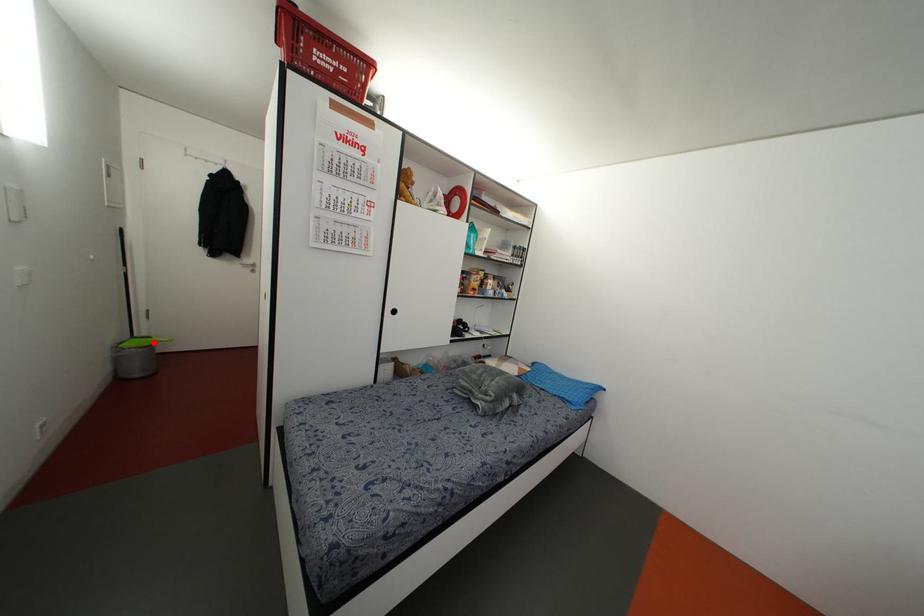
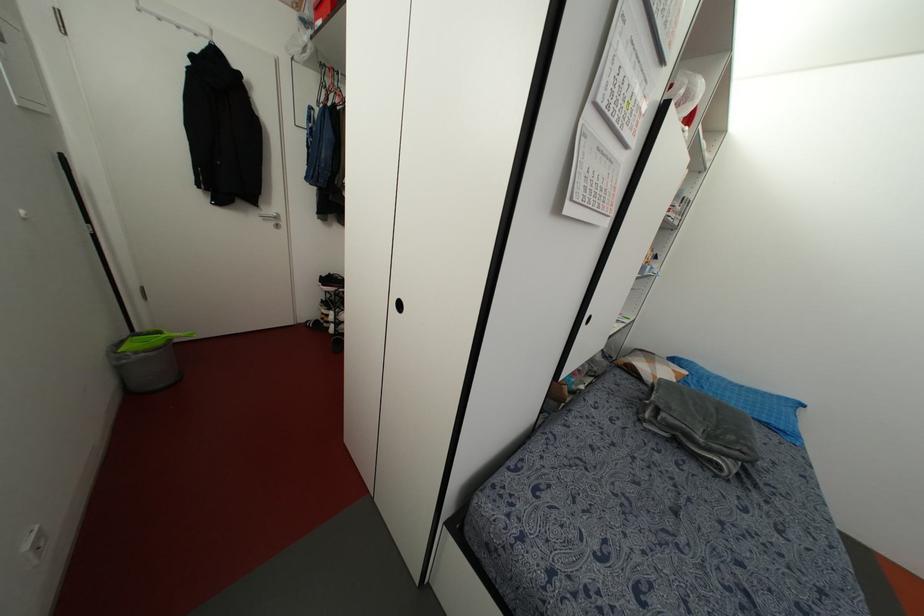
Question: I am providing you with two images of the same scene from different viewpoints. A red point is shown in image1. For the corresponding object point in image2, is it positioned nearer or farther from the camera?

Choices:
 (A) Nearer
 (B) Farther

Answer: (A)